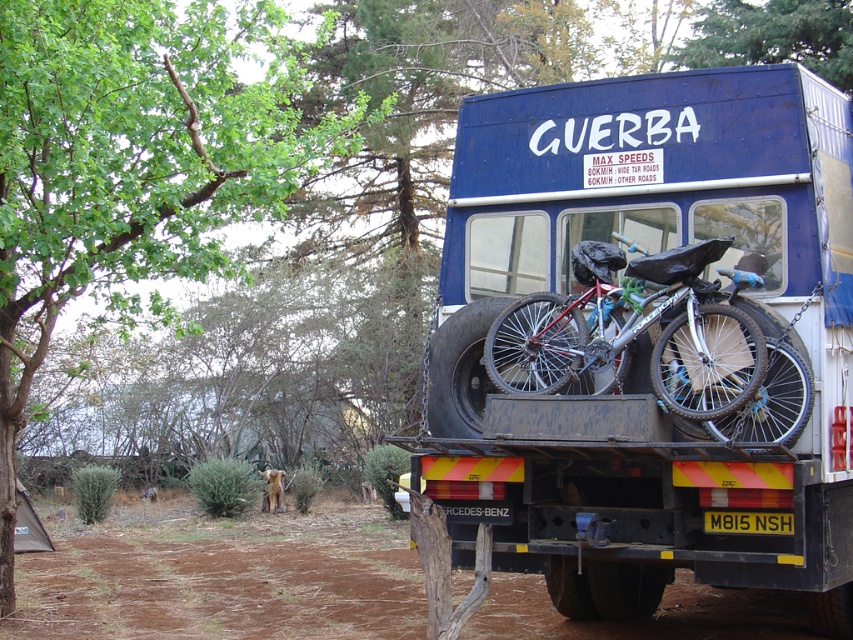
You are a delivery driver who needs to transport two bicycles to a remote mountain area. The route includes both wide tar roads and narrow unpaved paths. Given the information on the truck, will the blue matte trailer truck at center be suitable for this journey?

The blue matte trailer truck at center has specified maximum speeds of 80KM per hour for wide tar roads and 60KM per hour for other roads, which suggests it is designed to handle both types of terrain. Since the route includes both wide tar roads and narrow unpaved paths, the truck should be suitable for the journey as it accommodates different road conditions.

You are standing in front of the blue truck with the GUERBA logo. There are two points marked on the truck bed where the bicycles are placed. Which point is closer to you, point (778, 515) or point (502, 388)?

Point (778, 515) is closer to the viewer than point (502, 388).

Looking at this image, you are a delivery driver planning to transport a silver metallic bicycle at center through a narrow alley that is only as wide as the blue matte trailer truck at center. Can the bicycle fit through the alley without any modifications?

The blue matte trailer truck at center is wider than the silver metallic bicycle at center. Since the alley is as wide as the truck, the bicycle can fit through the alley without any modifications.